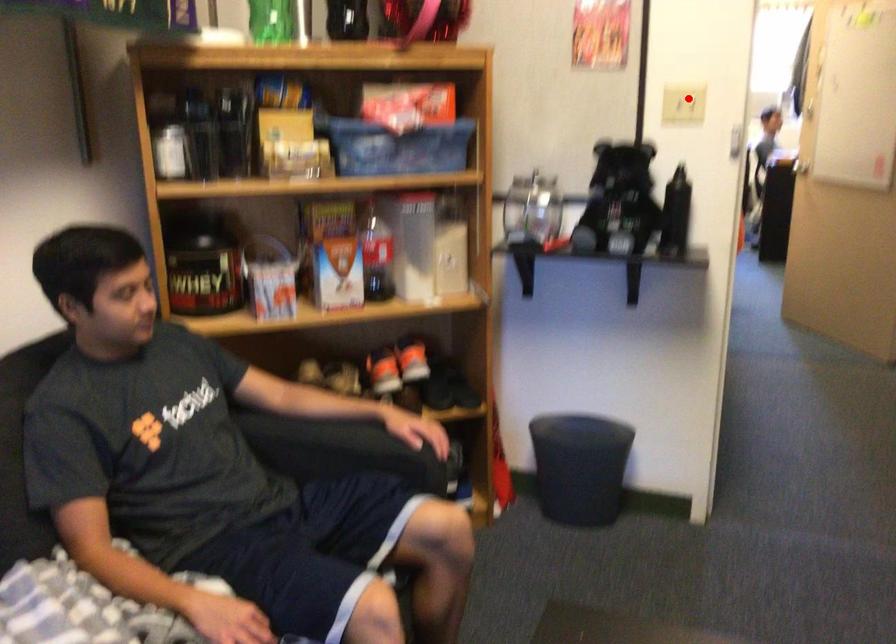
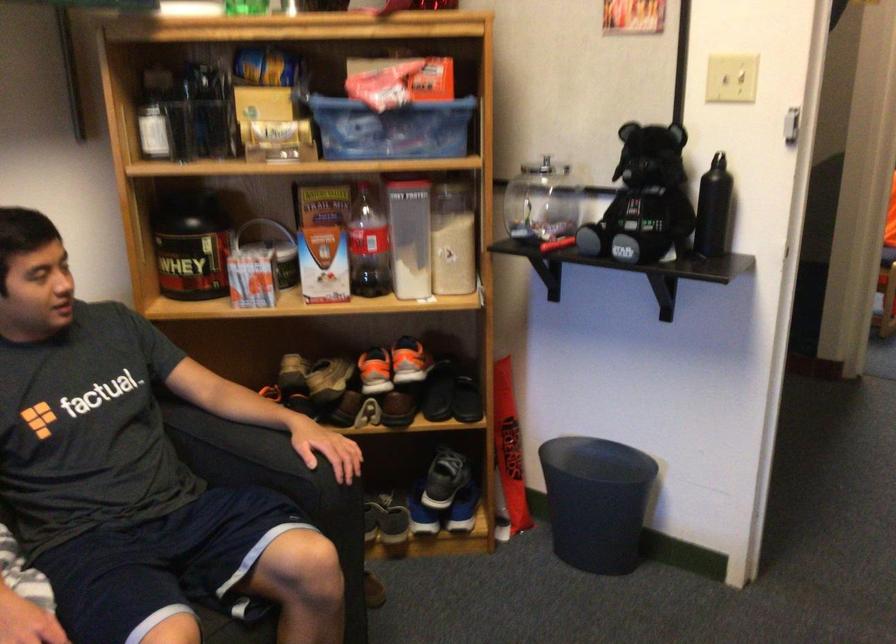
Locate, in the second image, the point that corresponds to the highlighted location in the first image.

(730, 78)